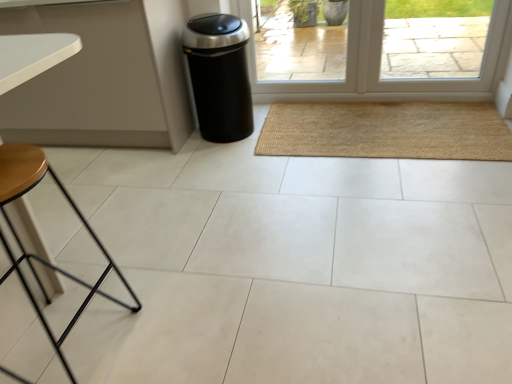
Find the location of a particular element. This screenshot has width=512, height=384. transparent glass door at center is located at coordinates (298, 49).

This screenshot has width=512, height=384. What do you see at coordinates (219, 75) in the screenshot?
I see `black matte trash can at center-left` at bounding box center [219, 75].

The image size is (512, 384). What do you see at coordinates (386, 131) in the screenshot?
I see `natural fiber mat at center` at bounding box center [386, 131].

Image resolution: width=512 pixels, height=384 pixels. I want to click on transparent glass door at center, so click(298, 49).

Which object is positioned more to the left, transparent glass door at center or natural fiber mat at center?

transparent glass door at center.

The width and height of the screenshot is (512, 384). In order to click on mat on the right of transparent glass door at center in this screenshot , I will do `click(386, 131)`.

Can you confirm if transparent glass door at center is thinner than natural fiber mat at center?

Correct, the width of transparent glass door at center is less than that of natural fiber mat at center.

Between transparent glass door at center and wooden stool at lower left, which one has larger size?

With larger size is wooden stool at lower left.

Considering the sizes of transparent glass door at center and wooden stool at lower left in the image, is transparent glass door at center taller or shorter than wooden stool at lower left?

Clearly, transparent glass door at center is shorter compared to wooden stool at lower left.

Do you think wooden stool at lower left is within transparent glass door at center, or outside of it?

wooden stool at lower left is outside transparent glass door at center.

Does wooden stool at lower left have a greater height compared to transparent glass door at center?

Yes.

Which object is positioned more to the right, wooden stool at lower left or transparent glass door at center?

Positioned to the right is transparent glass door at center.

Can you confirm if wooden stool at lower left is thinner than transparent glass door at center?

In fact, wooden stool at lower left might be wider than transparent glass door at center.

Is natural fiber mat at center not inside transparent glass door at center?

natural fiber mat at center lies outside transparent glass door at center's area.

How different are the orientations of natural fiber mat at center and transparent glass door at center in degrees?

0.456 degrees separate the facing orientations of natural fiber mat at center and transparent glass door at center.

Is natural fiber mat at center positioned with its back to transparent glass door at center?

No, natural fiber mat at center's orientation is not away from transparent glass door at center.

Considering the points (492, 110) and (103, 248), which point is behind, point (492, 110) or point (103, 248)?

The point (492, 110) is more distant.

In terms of width, does natural fiber mat at center look wider or thinner when compared to wooden stool at lower left?

In the image, natural fiber mat at center appears to be wider than wooden stool at lower left.

Is natural fiber mat at center bigger or smaller than wooden stool at lower left?

Considering their sizes, natural fiber mat at center takes up less space than wooden stool at lower left.

Considering the relative sizes of black matte trash can at center-left and natural fiber mat at center in the image provided, is black matte trash can at center-left bigger than natural fiber mat at center?

Correct, black matte trash can at center-left is larger in size than natural fiber mat at center.

Considering the points (220, 41) and (350, 143), which point is in front, point (220, 41) or point (350, 143)?

Positioned in front is point (220, 41).

From the image's perspective, which one is positioned lower, black matte trash can at center-left or natural fiber mat at center?

natural fiber mat at center is shown below in the image.

This screenshot has height=384, width=512. Find the location of `waste container that is on the right side of wooden stool at lower left`. waste container that is on the right side of wooden stool at lower left is located at coordinates tap(219, 75).

From a real-world perspective, relative to wooden stool at lower left, is black matte trash can at center-left vertically above or below?

black matte trash can at center-left is situated lower than wooden stool at lower left in the real world.

In the scene shown: Is black matte trash can at center-left oriented towards wooden stool at lower left?

Yes, black matte trash can at center-left is facing wooden stool at lower left.

The height and width of the screenshot is (384, 512). What are the coordinates of `window above the natural fiber mat at center (from the image's perspective)` in the screenshot? It's located at (298, 49).

You are a GUI agent. You are given a task and a screenshot of the screen. Output one action in this format:
    pyautogui.click(x=<x>, y=<y>)
    Task: Click on the furniture on the left of transparent glass door at center
    The width and height of the screenshot is (512, 384).
    Given the screenshot: What is the action you would take?
    pyautogui.click(x=35, y=255)

Considering their positions, is black matte trash can at center-left positioned further to natural fiber mat at center than transparent glass door at center?

black matte trash can at center-left lies further to natural fiber mat at center than the other object.

Which object lies further to the anchor point natural fiber mat at center, wooden stool at lower left or transparent glass door at center?

wooden stool at lower left is positioned further to the anchor natural fiber mat at center.

When comparing their distances from natural fiber mat at center, does transparent glass door at center or wooden stool at lower left seem closer?

The object closer to natural fiber mat at center is transparent glass door at center.

Looking at the image, which one is located further to wooden stool at lower left, black matte trash can at center-left or transparent glass door at center?

transparent glass door at center.

Considering their positions, is wooden stool at lower left positioned further to black matte trash can at center-left than natural fiber mat at center?

wooden stool at lower left lies further to black matte trash can at center-left than the other object.

From the image, which object appears to be farther from transparent glass door at center, natural fiber mat at center or black matte trash can at center-left?

The object further to transparent glass door at center is black matte trash can at center-left.

Which object lies further to the anchor point wooden stool at lower left, natural fiber mat at center or black matte trash can at center-left?

natural fiber mat at center is further to wooden stool at lower left.

Based on the photo, considering their positions, is wooden stool at lower left positioned further to black matte trash can at center-left than transparent glass door at center?

Based on the image, wooden stool at lower left appears to be further to black matte trash can at center-left.

This screenshot has width=512, height=384. Find the location of `mat positioned between wooden stool at lower left and transparent glass door at center from near to far`. mat positioned between wooden stool at lower left and transparent glass door at center from near to far is located at coordinates (386, 131).

This screenshot has height=384, width=512. I want to click on mat between wooden stool at lower left and black matte trash can at center-left along the z-axis, so click(386, 131).

This screenshot has height=384, width=512. Identify the location of waste container located between wooden stool at lower left and transparent glass door at center in the depth direction. click(219, 75).

This screenshot has height=384, width=512. I want to click on window situated between black matte trash can at center-left and natural fiber mat at center from left to right, so click(298, 49).